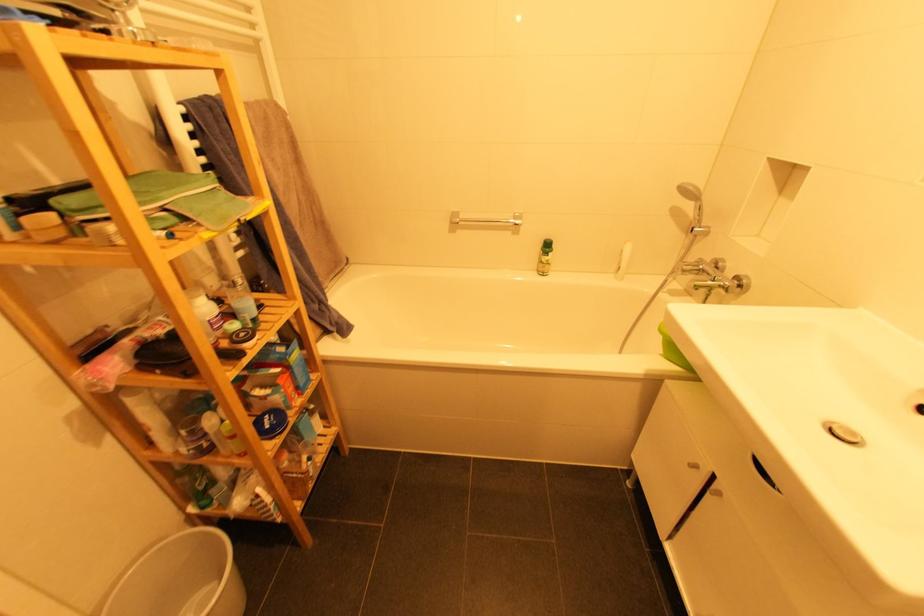
Find where to push the bottle pump top. Please return your answer as a coordinate pair (x, y).

(544, 257)